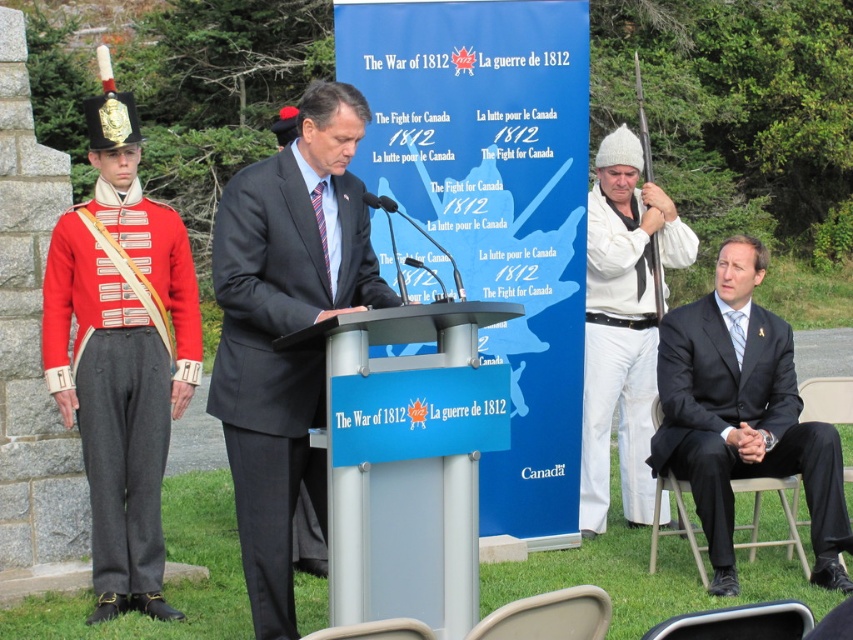
Who is more forward, (158, 232) or (645, 362)?

Point (158, 232) is more forward.

Does point (77, 260) come in front of point (634, 465)?

That is True.

This screenshot has height=640, width=853. Identify the location of red wool uniform at left. (120, 353).

In the scene shown: Between dark gray suit at center and red wool uniform at left, which one appears on the right side from the viewer's perspective?

Positioned to the right is dark gray suit at center.

Which is behind, point (213, 362) or point (148, 449)?

The point (148, 449) is more distant.

Is point (277, 288) positioned before point (59, 316)?

Yes, point (277, 288) is in front of point (59, 316).

In order to click on dark gray suit at center in this screenshot , I will do `click(286, 328)`.

Is dark gray suit at center to the left of black suit at right from the viewer's perspective?

Yes, dark gray suit at center is to the left of black suit at right.

Does dark gray suit at center have a greater height compared to black suit at right?

Yes.

Where is `dark gray suit at center`? The width and height of the screenshot is (853, 640). dark gray suit at center is located at coordinates (286, 328).

Identify the location of dark gray suit at center. The height and width of the screenshot is (640, 853). [286, 328].